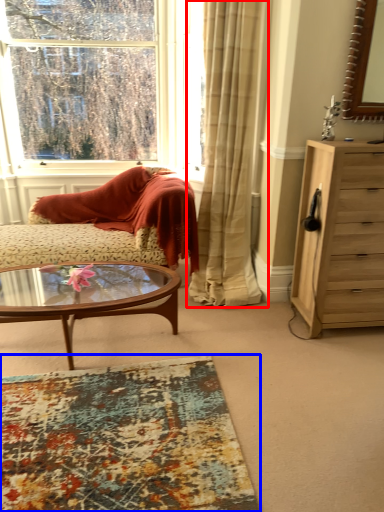
Question: Which of the following is the farthest to the observer, curtain (highlighted by a red box) or plain (highlighted by a blue box)?

Choices:
 (A) curtain
 (B) plain

Answer: (A)